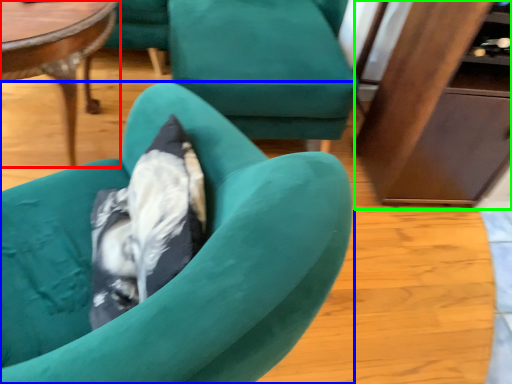
Question: Which is nearer to the coffee table (highlighted by a red box)? chair (highlighted by a blue box) or dresser (highlighted by a green box).

Choices:
 (A) chair
 (B) dresser

Answer: (A)